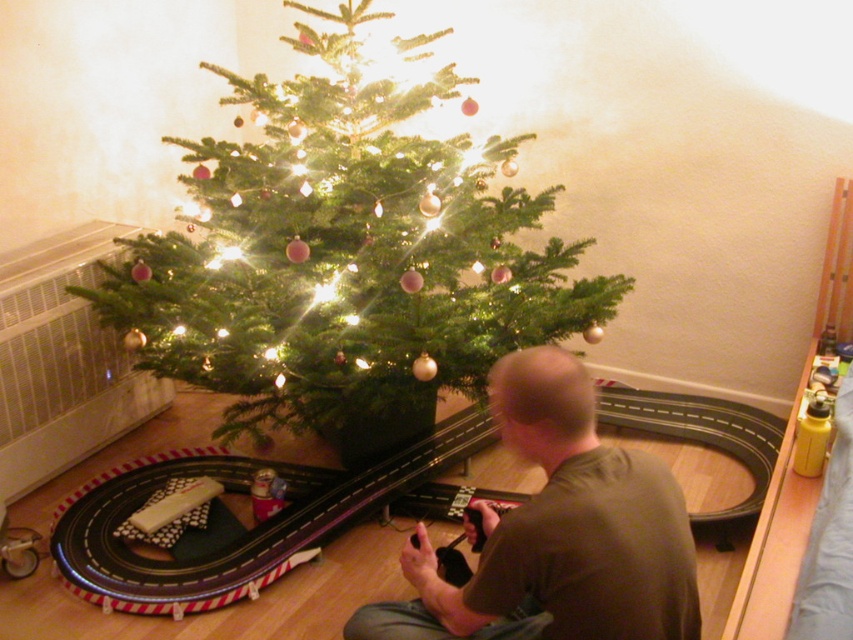
You are standing in the room and want to place a small gift under the green matte christmas tree at center. The point where you should place the gift is located at coordinates point (345, 257). Is this point on the green matte christmas tree at center?

Yes, the point (345, 257) is on the green matte christmas tree at center, so placing the gift there would be appropriate.

You are a delivery person who needs to place a package between the green matte christmas tree at center and the brown cotton shirt at center. The package measures 1 meter in length. Will it fit in the space between them?

The distance between the green matte christmas tree at center and the brown cotton shirt at center is 84.18 centimeters. Since the package is 1 meter long, which is longer than the available space, it will not fit between them.